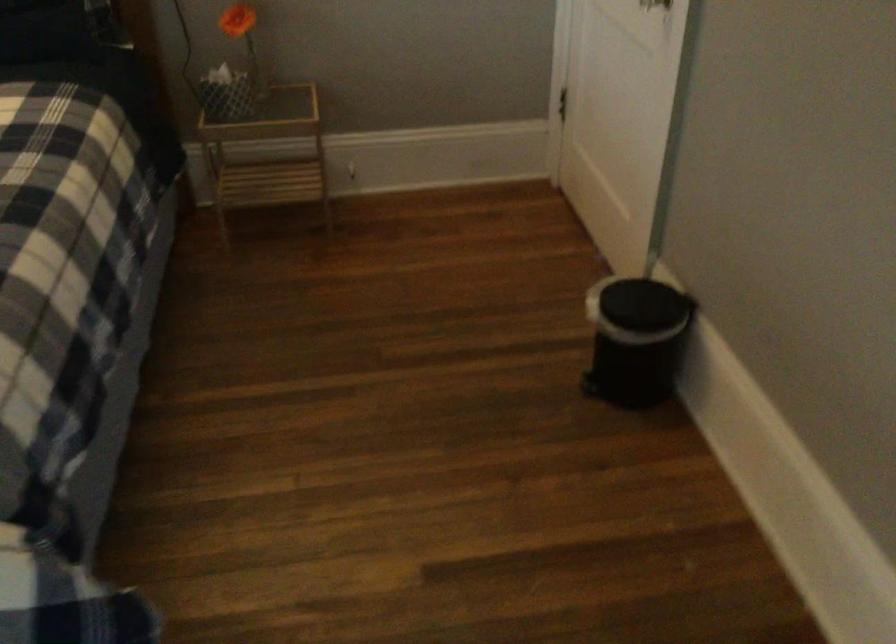
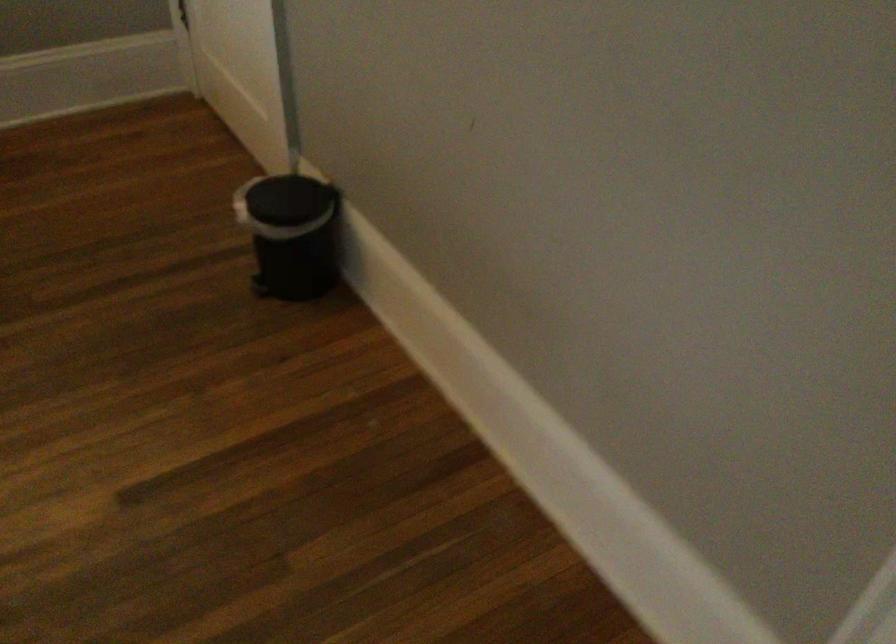
Question: The camera is either moving clockwise (left) or counter-clockwise (right) around the object. The first image is from the beginning of the video and the second image is from the end. Is the camera moving left or right when shooting the video?

Choices:
 (A) Left
 (B) Right

Answer: (A)